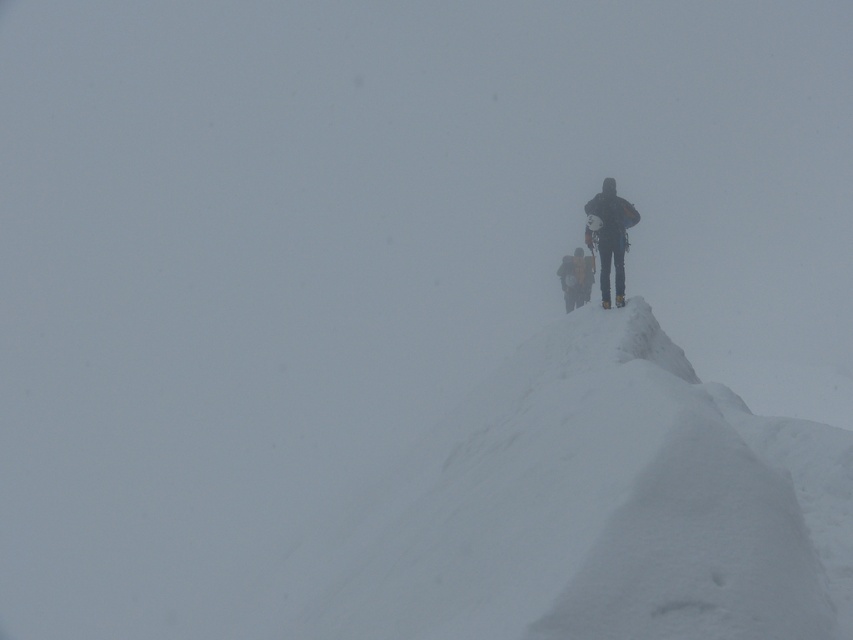
You are planning to set up a tent on the white snow at center. However, you notice the yellow fabric backpack at center is already placed there. Based on the scene, can the backpack be moved to a lower area to make space for the tent?

The white snow at center has a greater height compared to the yellow fabric backpack at center. Since the snow is higher, the backpack can be moved to a lower area to make space for the tent.

You are a mountaineer assessing the terrain ahead. You notice the white snow at center and the yellow fabric backpack at center. Which object is nearer to you as you stand on the ridge?

The white snow at center is closer to the viewer than the yellow fabric backpack at center, so the white snow at center is nearer to you.

You are planning to take a photo of the dark blue fabric jacket at upper right and the yellow fabric backpack at center in the snowy mountain scene. Which object should you focus on first if you want to capture both clearly in the same frame?

The dark blue fabric jacket at upper right is smaller than the yellow fabric backpack at center, so you should focus on the yellow fabric backpack at center first to ensure it is in clear focus before adjusting for the smaller jacket.